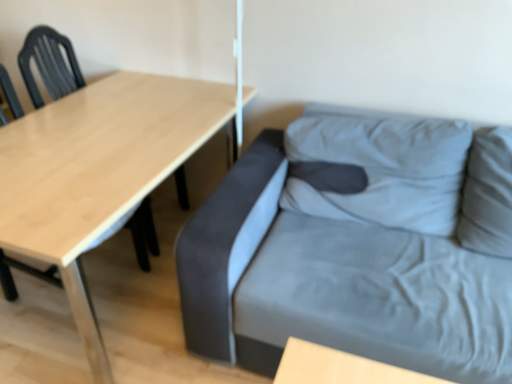
Question: Is point pos(376,167) positioned closer to the camera than point pos(10,259)?

Choices:
 (A) farther
 (B) closer

Answer: (B)

Question: Would you say suede gray couch at right is to the left or to the right of matte black chair at left in the picture?

Choices:
 (A) right
 (B) left

Answer: (A)

Question: Estimate the real-world distances between objects in this image. Which object is closer to the suede gray couch at right?

Choices:
 (A) matte black chair at left
 (B) wooden table at left

Answer: (B)

Question: Which object is positioned farthest from the wooden table at left?

Choices:
 (A) suede gray couch at right
 (B) matte black chair at left

Answer: (A)